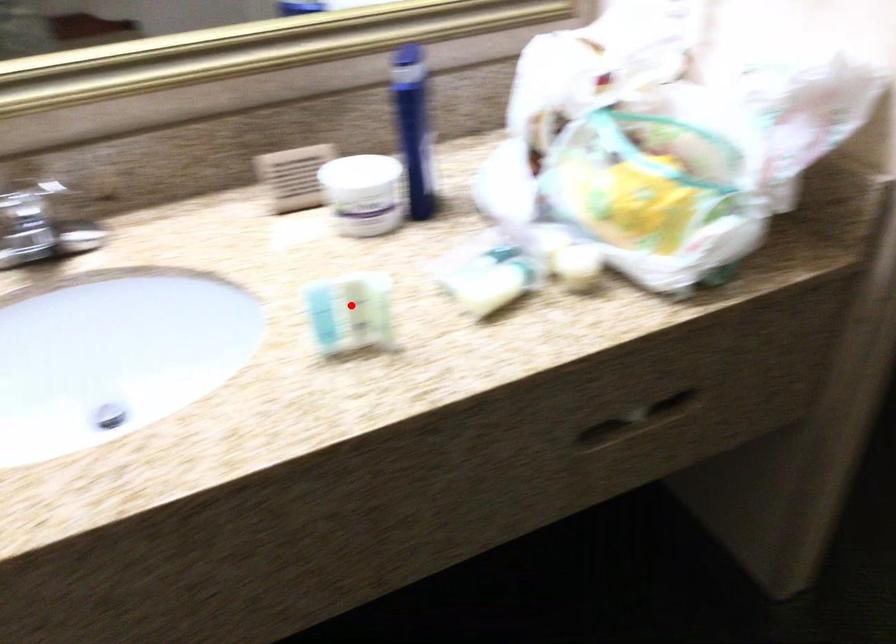
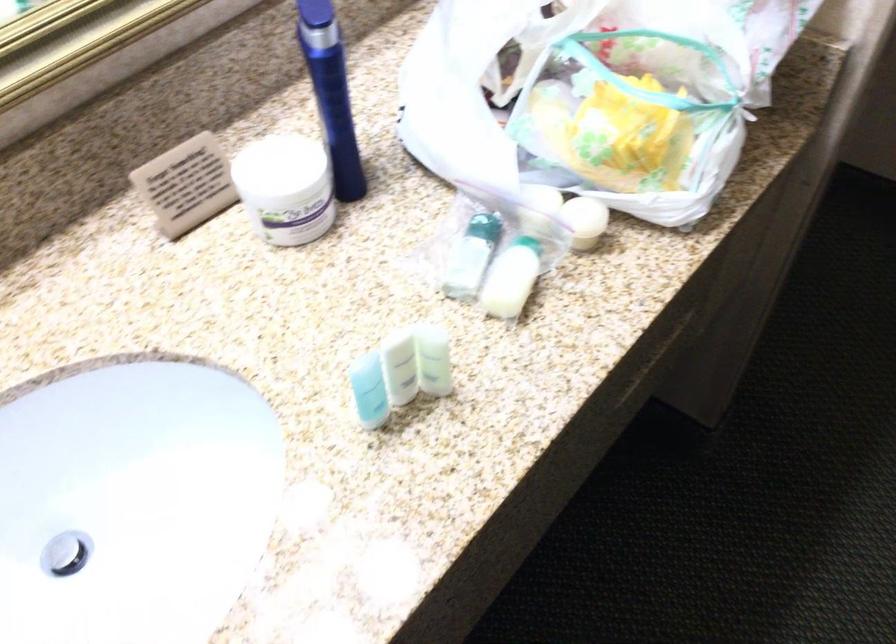
Locate, in the second image, the point that corresponds to the highlighted location in the first image.

(400, 368)